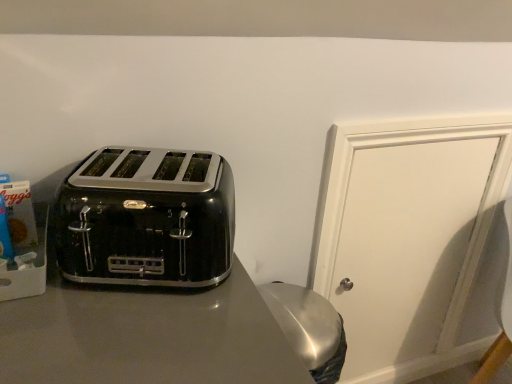
The height and width of the screenshot is (384, 512). Describe the element at coordinates (146, 219) in the screenshot. I see `black glossy toaster at left` at that location.

Looking at this image, in order to face black glossy toaster at left, should I rotate leftwards or rightwards?

To face it directly, rotate left by 13.414 degrees.

Image resolution: width=512 pixels, height=384 pixels. In order to click on black glossy toaster at left in this screenshot , I will do `click(146, 219)`.

What do you see at coordinates (407, 237) in the screenshot?
I see `white matte door at center` at bounding box center [407, 237].

Identify the location of white matte door at center. This screenshot has width=512, height=384. (407, 237).

This screenshot has width=512, height=384. I want to click on black glossy toaster at left, so click(x=146, y=219).

Is white matte door at center at the right side of black glossy toaster at left?

Indeed, white matte door at center is positioned on the right side of black glossy toaster at left.

Which object is further away from the camera, white matte door at center or black glossy toaster at left?

white matte door at center.

Which is in front, point (347, 220) or point (125, 233)?

The point (125, 233) is closer to the camera.

From the image's perspective, would you say white matte door at center is shown under black glossy toaster at left?

Yes.

From a real-world perspective, which object stands above the other?

In real-world perspective, black glossy toaster at left is above.

Considering the relative sizes of white matte door at center and black glossy toaster at left in the image provided, is white matte door at center thinner than black glossy toaster at left?

Yes, white matte door at center is thinner than black glossy toaster at left.

Can you confirm if white matte door at center is shorter than black glossy toaster at left?

In fact, white matte door at center may be taller than black glossy toaster at left.

From the picture: Considering the relative sizes of white matte door at center and black glossy toaster at left in the image provided, is white matte door at center bigger than black glossy toaster at left?

Yes, white matte door at center is bigger than black glossy toaster at left.

Is white matte door at center surrounding black glossy toaster at left?

No, black glossy toaster at left is not surrounded by white matte door at center.

Is the surface of white matte door at center in direct contact with black glossy toaster at left?

There is a gap between white matte door at center and black glossy toaster at left.

Is black glossy toaster at left at the back of white matte door at center?

No, black glossy toaster at left is not at the back of white matte door at center.

How different are the orientations of white matte door at center and black glossy toaster at left in degrees?

20.1 degrees.

The height and width of the screenshot is (384, 512). What are the coordinates of `toaster located in front of the white matte door at center` in the screenshot? It's located at pyautogui.click(x=146, y=219).

Considering the relative positions of black glossy toaster at left and white matte door at center in the image provided, is black glossy toaster at left to the right of white matte door at center from the viewer's perspective?

In fact, black glossy toaster at left is to the left of white matte door at center.

Does black glossy toaster at left come behind white matte door at center?

No, black glossy toaster at left is closer to the camera.

Is point (99, 255) behind point (394, 226)?

No, (99, 255) is closer to viewer.

From the image's perspective, does black glossy toaster at left appear lower than white matte door at center?

Incorrect, from the image's perspective, black glossy toaster at left is higher than white matte door at center.

From a real-world perspective, is black glossy toaster at left beneath white matte door at center?

No, from a real-world perspective, black glossy toaster at left is not beneath white matte door at center.

Which object is thinner, black glossy toaster at left or white matte door at center?

With smaller width is white matte door at center.

Can you confirm if black glossy toaster at left is taller than white matte door at center?

No, black glossy toaster at left is not taller than white matte door at center.

Between black glossy toaster at left and white matte door at center, which one has larger size?

white matte door at center is bigger.

Is white matte door at center completely or partially inside black glossy toaster at left?

No, white matte door at center is not a part of black glossy toaster at left.

Is there a large distance between black glossy toaster at left and white matte door at center?

No, black glossy toaster at left is in close proximity to white matte door at center.

Is black glossy toaster at left facing towards white matte door at center?

No.

Where is `toaster in front of the white matte door at center`? toaster in front of the white matte door at center is located at coordinates (x=146, y=219).

Where is `door lying on the right of black glossy toaster at left`? The image size is (512, 384). door lying on the right of black glossy toaster at left is located at coordinates (407, 237).

Locate an element on the screen. This screenshot has width=512, height=384. door located below the black glossy toaster at left (from the image's perspective) is located at coordinates (407, 237).